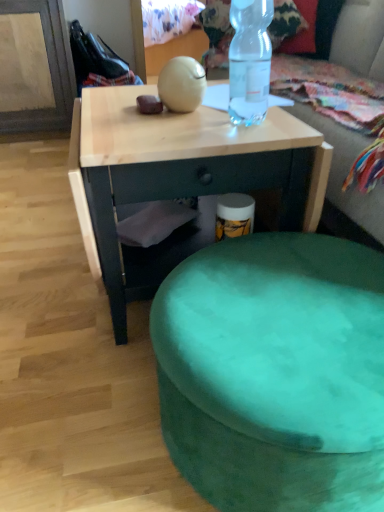
I want to click on vacant space positioned to the left of transparent plastic bottle at upper center, so click(x=179, y=125).